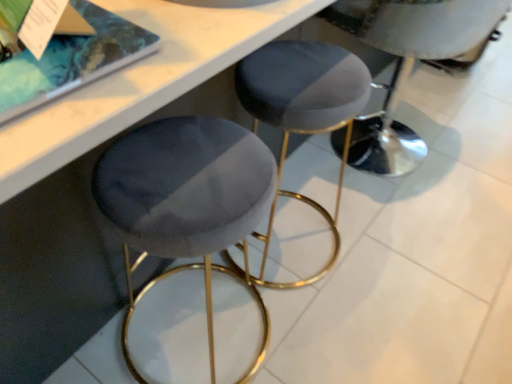
The width and height of the screenshot is (512, 384). I want to click on free space between velvet grey stool at center and velvet grey stool at center, so click(339, 199).